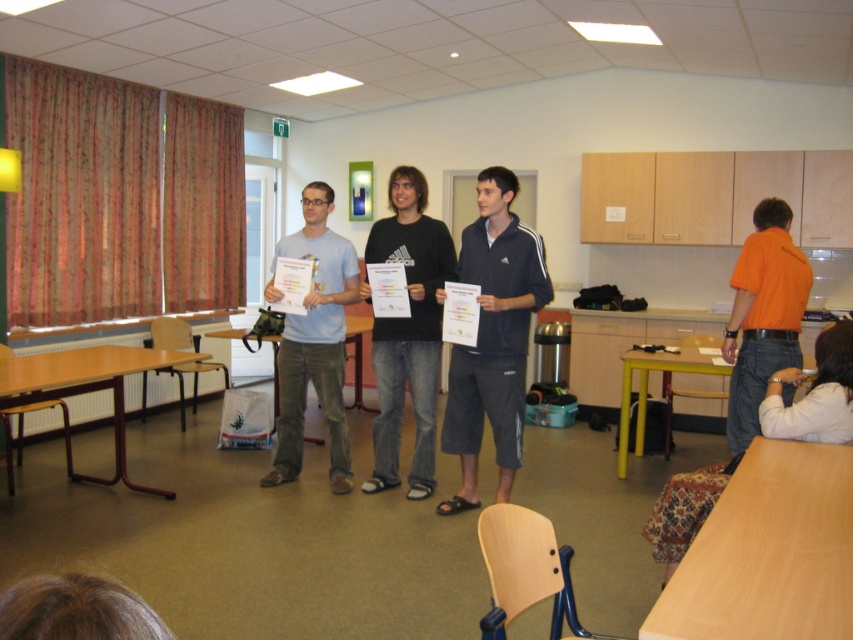
Question: Can you confirm if black cotton shirt at center is bigger than orange cotton shirt at right?

Choices:
 (A) no
 (B) yes

Answer: (B)

Question: Can you confirm if matte light blue t-shirt at center is smaller than orange cotton shirt at right?

Choices:
 (A) yes
 (B) no

Answer: (B)

Question: Considering the real-world distances, which object is closest to the dark blue athletic shorts at center?

Choices:
 (A) orange cotton shirt at right
 (B) matte light blue t-shirt at center
 (C) black cotton shirt at center

Answer: (C)

Question: Which object appears closest to the camera in this image?

Choices:
 (A) dark blue athletic shorts at center
 (B) black cotton shirt at center
 (C) orange cotton shirt at right
 (D) matte light blue t-shirt at center

Answer: (A)

Question: Which point is farther to the camera?

Choices:
 (A) orange cotton shirt at right
 (B) dark blue athletic shorts at center

Answer: (A)

Question: From the image, what is the correct spatial relationship of dark blue athletic shorts at center in relation to orange cotton shirt at right?

Choices:
 (A) left
 (B) right

Answer: (A)